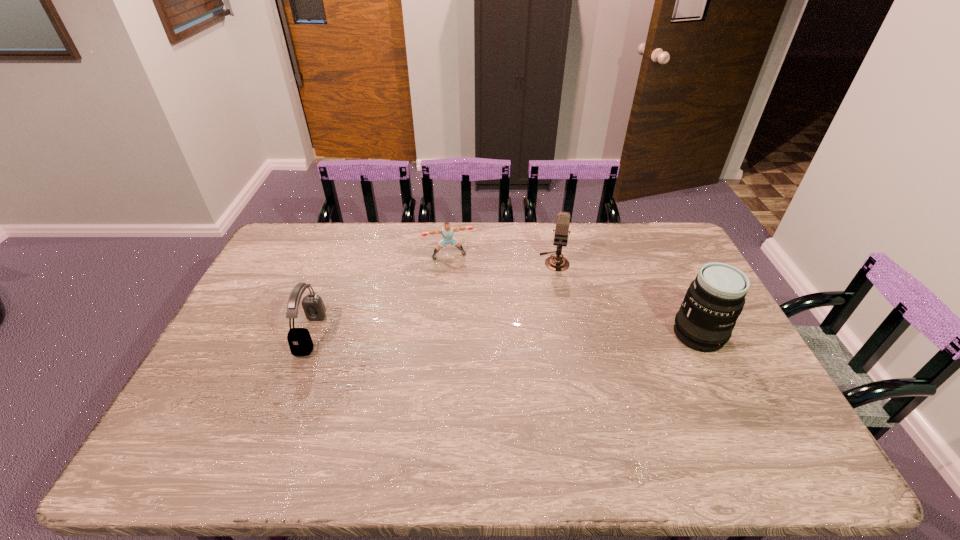
Find the location of `free space at the near edge of the desktop`. free space at the near edge of the desktop is located at coordinates (367, 414).

Locate an element on the screen. The image size is (960, 540). vacant region at the left edge of the desktop is located at coordinates (283, 329).

In the image, there is a desktop. Identify the location of free region at the right edge. (747, 353).

Identify the location of vacant area at the far right corner of the desktop. (656, 227).

Locate an element on the screen. The width and height of the screenshot is (960, 540). free spot between the second object from left to right and the headset is located at coordinates (380, 294).

The image size is (960, 540). In order to click on free space between the second object from right to left and the telephoto lens in this screenshot , I will do `click(627, 298)`.

The width and height of the screenshot is (960, 540). Identify the location of empty location between the second object from left to right and the rightmost object. (574, 295).

Where is `vacant space that is in between the leftmost object and the shortest object`? The width and height of the screenshot is (960, 540). vacant space that is in between the leftmost object and the shortest object is located at coordinates (380, 294).

You are a GUI agent. You are given a task and a screenshot of the screen. Output one action in this format:
    pyautogui.click(x=<x>, y=<y>)
    Task: Click on the vacant point located between the shortest object and the leftmost object
    The height and width of the screenshot is (540, 960).
    Given the screenshot: What is the action you would take?
    pyautogui.click(x=380, y=294)

Identify the location of free space between the shortest object and the rightmost object. (574, 295).